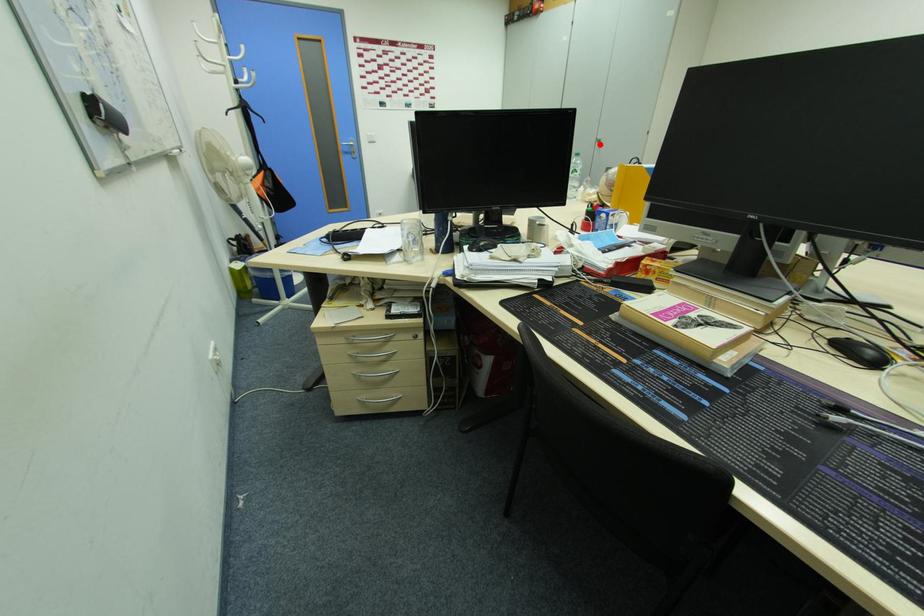
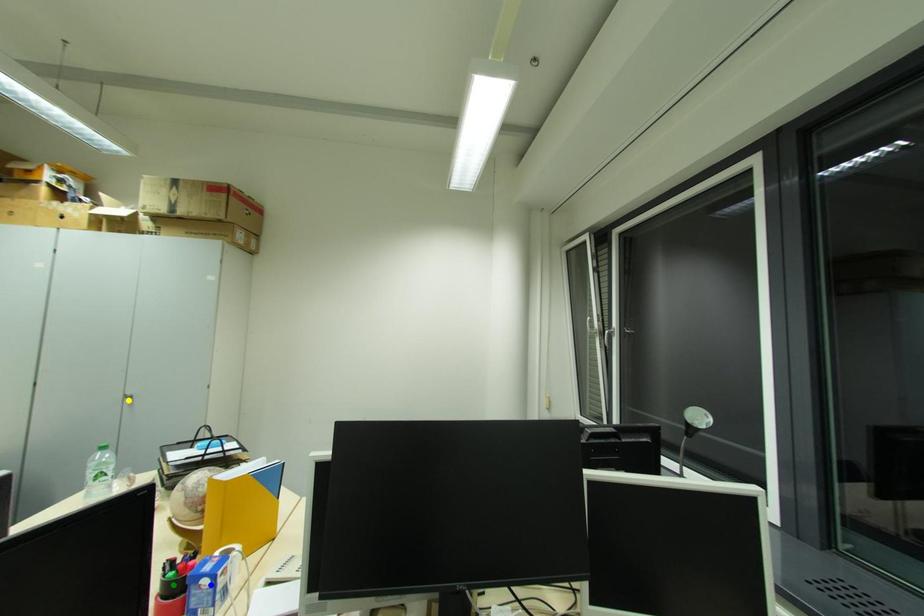
Question: I am providing you with two images of the same scene from different viewpoints. A red point is marked on the first image. You are given multiple points on the second image. Which spot in image 2 lines up with the point in image 1?

Choices:
 (A) yellow point
 (B) green point
 (C) blue point

Answer: (A)